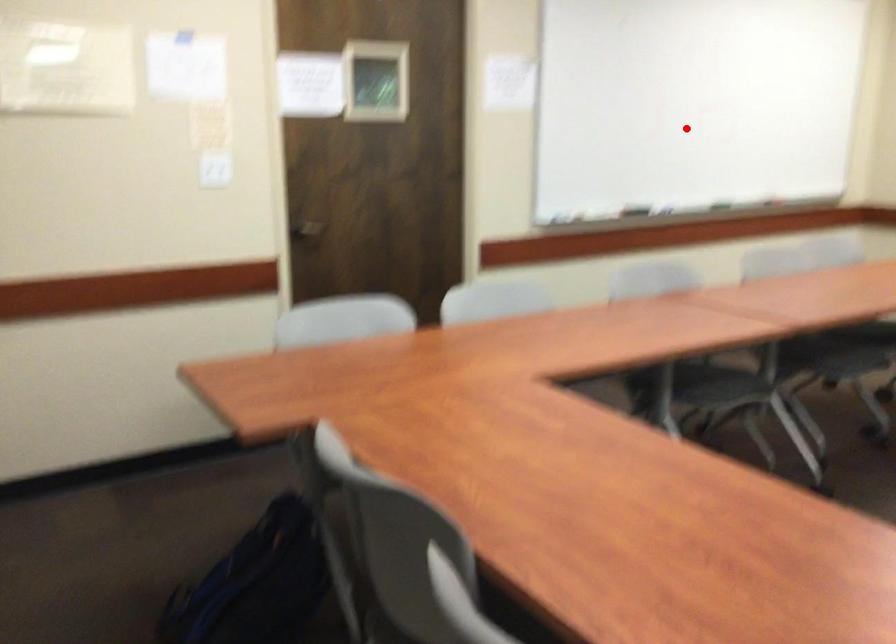
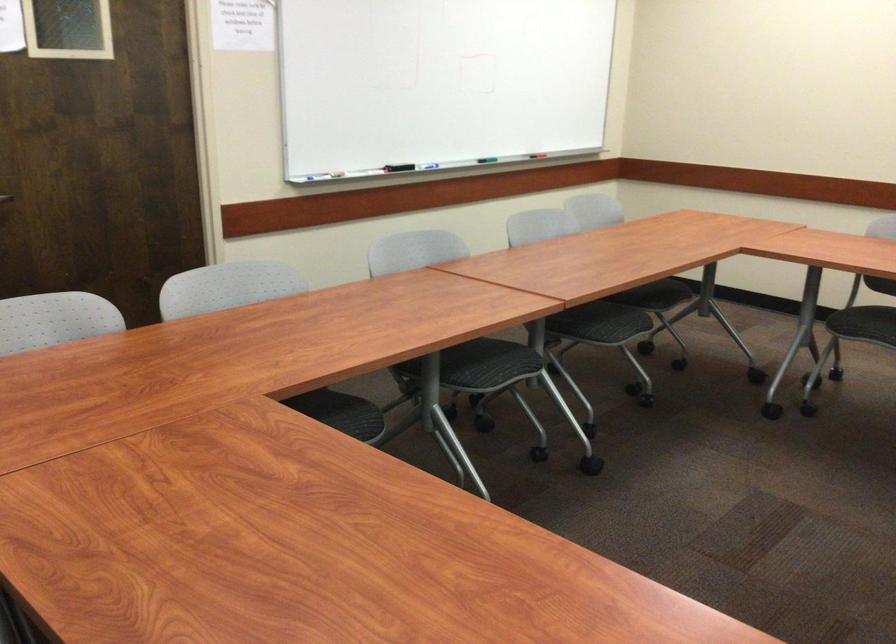
Locate, in the second image, the point that corresponds to the highlighted location in the first image.

(438, 82)